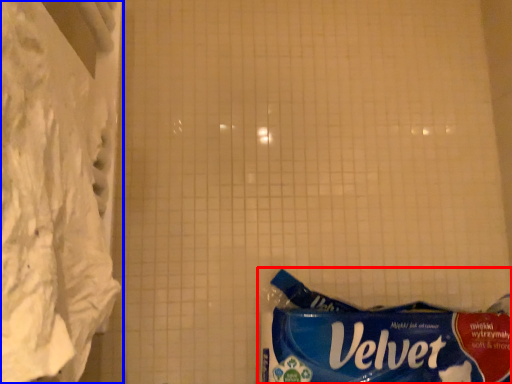
Question: Which object is closer to the camera taking this photo, waste (highlighted by a red box) or curtain (highlighted by a blue box)?

Choices:
 (A) waste
 (B) curtain

Answer: (B)